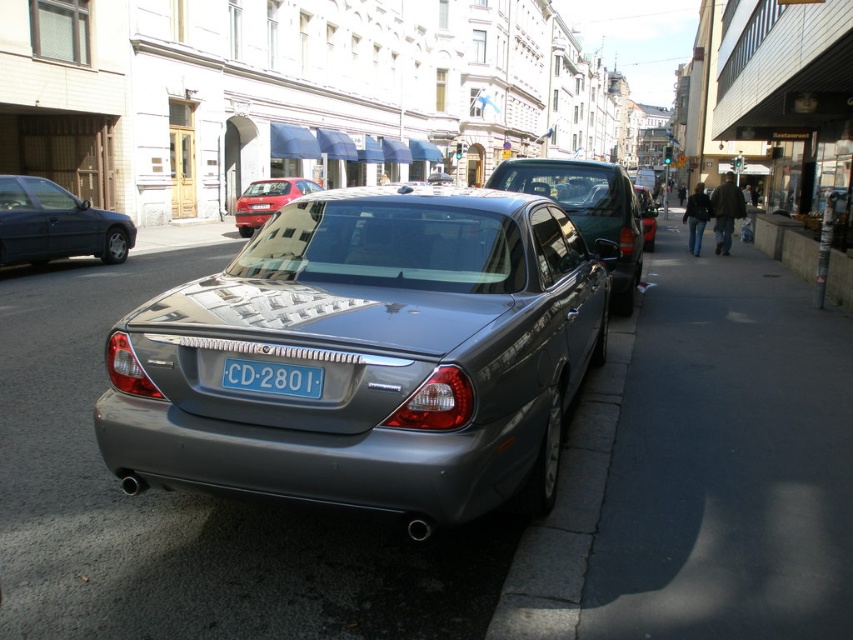
Question: Which of the following is the farthest from the observer?

Choices:
 (A) satin metallic sedan at center
 (B) blue metallic license plate at center

Answer: (B)

Question: Is matte black sedan at left thinner than metallic red sedan at center?

Choices:
 (A) no
 (B) yes

Answer: (A)

Question: Which of these objects is positioned farthest from the satin silver sedan at center?

Choices:
 (A) matte black sedan at left
 (B) satin metallic sedan at center

Answer: (A)

Question: Which of the following is the closest to the observer?

Choices:
 (A) (578, 188)
 (B) (258, 200)
 (C) (270, 365)

Answer: (C)

Question: Can you confirm if gray concrete curb at lower right is positioned to the left of metallic red sedan at center?

Choices:
 (A) yes
 (B) no

Answer: (B)

Question: Can you confirm if gray concrete curb at lower right is wider than blue metallic license plate at center?

Choices:
 (A) no
 (B) yes

Answer: (B)